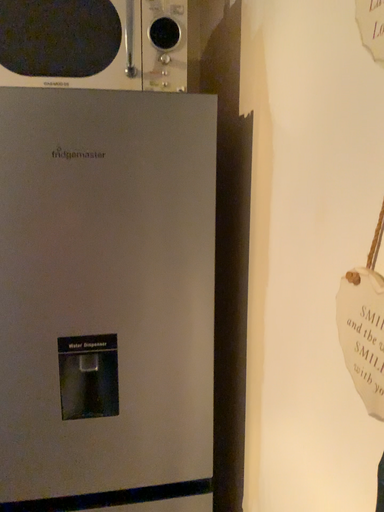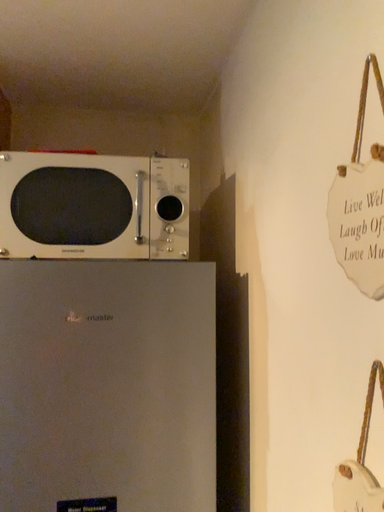
Question: Which way did the camera rotate in the video?

Choices:
 (A) rotated downward
 (B) rotated upward

Answer: (B)